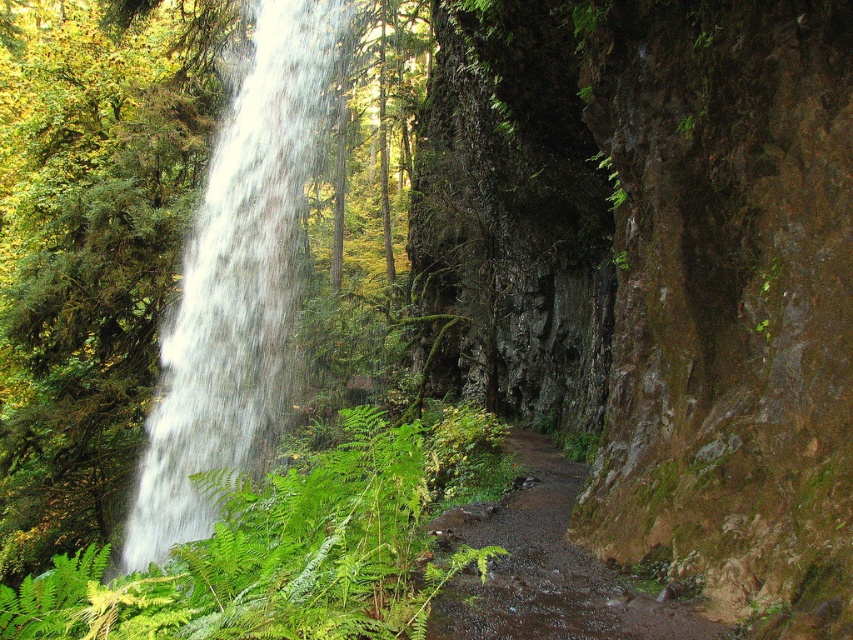
You are standing at the center of the scene and want to reach the white frothy water at left. Which direction should you move in to get there?

To reach the white frothy water at left from the center, you should move to the left since it is located at point (235,284) which is to the left side of the scene.